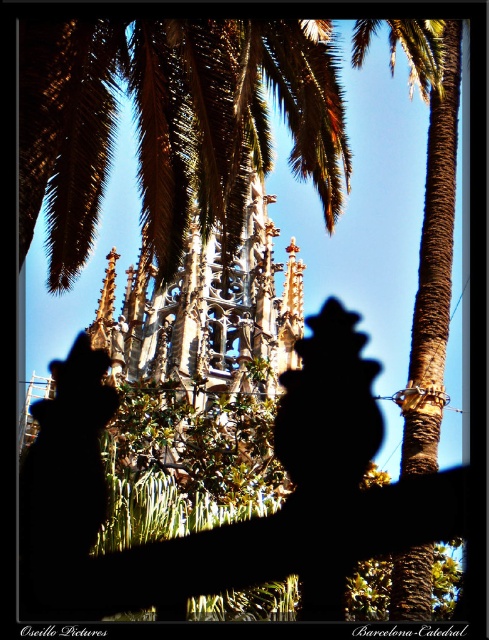
Can you confirm if green leafy palm at upper center is smaller than brown rough palm tree at center?

Yes, green leafy palm at upper center is smaller than brown rough palm tree at center.

Does green leafy palm at upper center have a greater height compared to brown rough palm tree at center?

In fact, green leafy palm at upper center may be shorter than brown rough palm tree at center.

Describe the element at coordinates (171, 124) in the screenshot. This screenshot has height=640, width=489. I see `green leafy palm at upper center` at that location.

You are a GUI agent. You are given a task and a screenshot of the screen. Output one action in this format:
    pyautogui.click(x=<x>, y=<y>)
    Task: Click on the green leafy palm at upper center
    Image resolution: width=489 pixels, height=640 pixels.
    Given the screenshot: What is the action you would take?
    pyautogui.click(x=171, y=124)